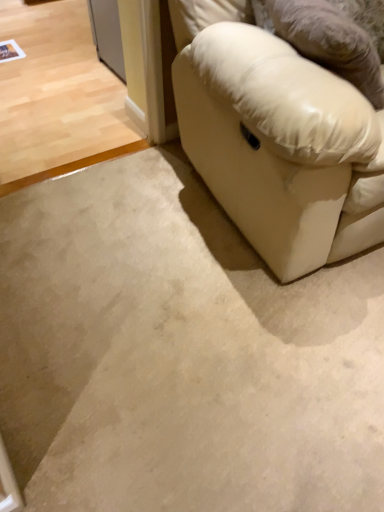
Question: Is beige carpet at lower right, positioned as the second concrete in back-to-front order, at the right side of beige carpet at lower left, which is the first concrete from back to front?

Choices:
 (A) no
 (B) yes

Answer: (B)

Question: From a real-world perspective, is beige carpet at lower right, which appears as the second concrete when viewed from the top, over beige carpet at lower left, the second concrete from the front?

Choices:
 (A) yes
 (B) no

Answer: (B)

Question: Is beige carpet at lower right, positioned as the first concrete in front-to-back order, positioned beyond the bounds of beige carpet at lower left, positioned as the 1th concrete in top-to-bottom order?

Choices:
 (A) no
 (B) yes

Answer: (B)

Question: Is beige carpet at lower right, positioned as the first concrete in front-to-back order, closer to the viewer compared to beige carpet at lower left, which is the second concrete in bottom-to-top order?

Choices:
 (A) no
 (B) yes

Answer: (B)

Question: Is beige carpet at lower right, which appears as the second concrete when viewed from the top, with beige carpet at lower left, positioned as the 1th concrete in top-to-bottom order?

Choices:
 (A) no
 (B) yes

Answer: (A)

Question: Does beige carpet at lower right, which appears as the second concrete when viewed from the top, have a greater width compared to beige carpet at lower left, the second concrete from the front?

Choices:
 (A) no
 (B) yes

Answer: (A)

Question: Would you say white leather couch at lower right is a long distance from leather-like beige pillow at right?

Choices:
 (A) no
 (B) yes

Answer: (A)

Question: Is white leather couch at lower right turned away from leather-like beige pillow at right?

Choices:
 (A) yes
 (B) no

Answer: (A)

Question: Is white leather couch at lower right to the left of leather-like beige pillow at right from the viewer's perspective?

Choices:
 (A) no
 (B) yes

Answer: (A)

Question: From a real-world perspective, is white leather couch at lower right under leather-like beige pillow at right?

Choices:
 (A) no
 (B) yes

Answer: (B)

Question: Can you confirm if white leather couch at lower right is bigger than leather-like beige pillow at right?

Choices:
 (A) no
 (B) yes

Answer: (B)

Question: Considering the relative sizes of white leather couch at lower right and leather-like beige pillow at right in the image provided, is white leather couch at lower right shorter than leather-like beige pillow at right?

Choices:
 (A) yes
 (B) no

Answer: (B)

Question: Is leather-like beige pillow at right located outside beige carpet at lower left, which is the first concrete from back to front?

Choices:
 (A) no
 (B) yes

Answer: (B)